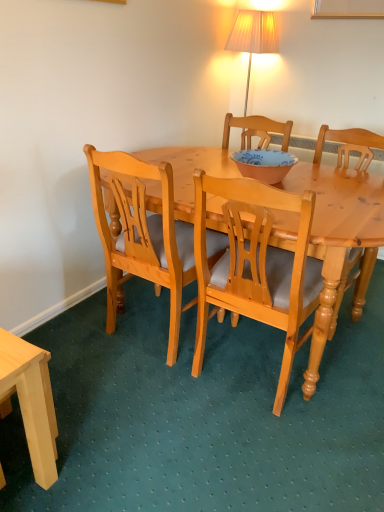
The image size is (384, 512). I want to click on free space that is in between light wood desk at lower left and light brown wood chair at center, acting as the third chair starting from the right, so click(x=105, y=383).